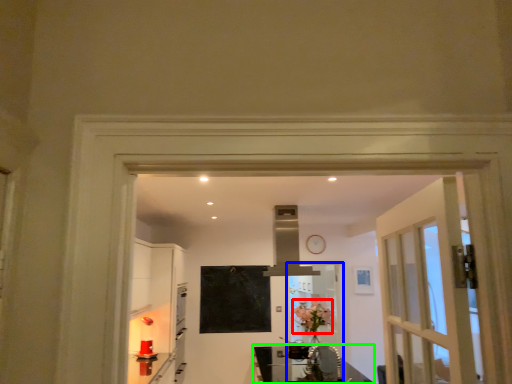
Question: Which object is positioned farthest from flower (highlighted by a red box)? Select from screen door (highlighted by a blue box) and table (highlighted by a green box).

Choices:
 (A) screen door
 (B) table

Answer: (B)